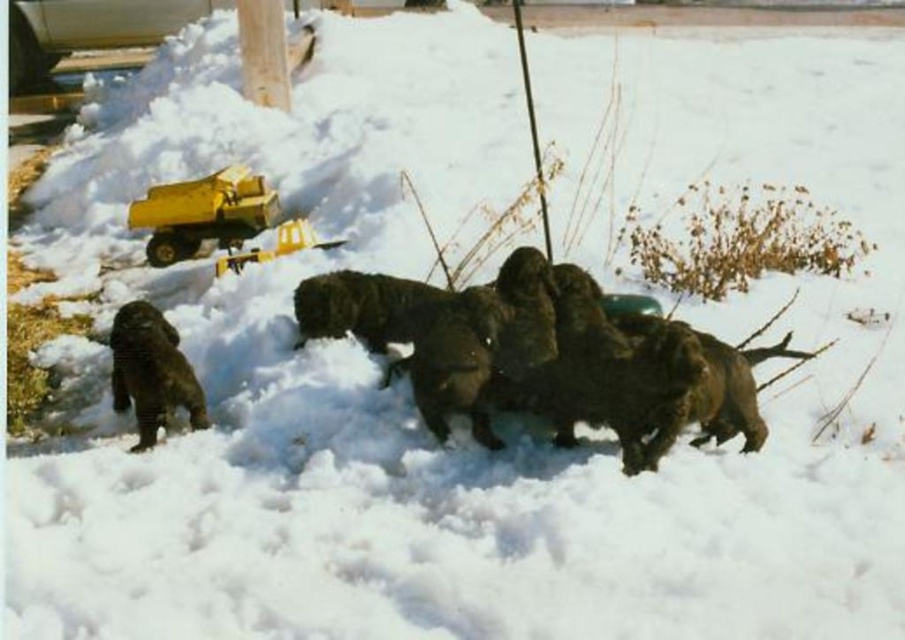
You are a child who wants to play with the yellow plastic toy at upper left but there is a fuzzy brown dog at center in the way. Can you walk around the dog to reach the toy?

The fuzzy brown dog at center might be wider than yellow plastic toy at upper left, so it is possible that the dog is blocking the path. However, since the exact width is uncertain, you should carefully check if there is enough space to walk around the dog to reach the yellow plastic toy at upper left.